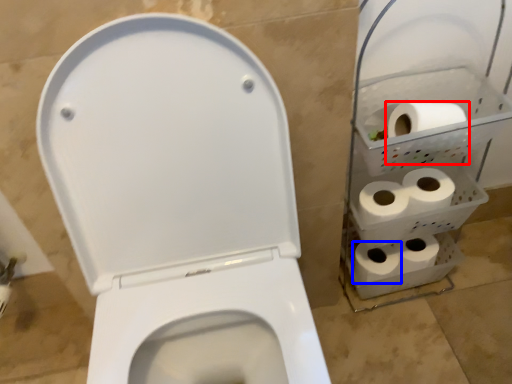
Question: Which of the following is the farthest to the observer, toilet paper (highlighted by a red box) or toilet paper (highlighted by a blue box)?

Choices:
 (A) toilet paper
 (B) toilet paper

Answer: (B)